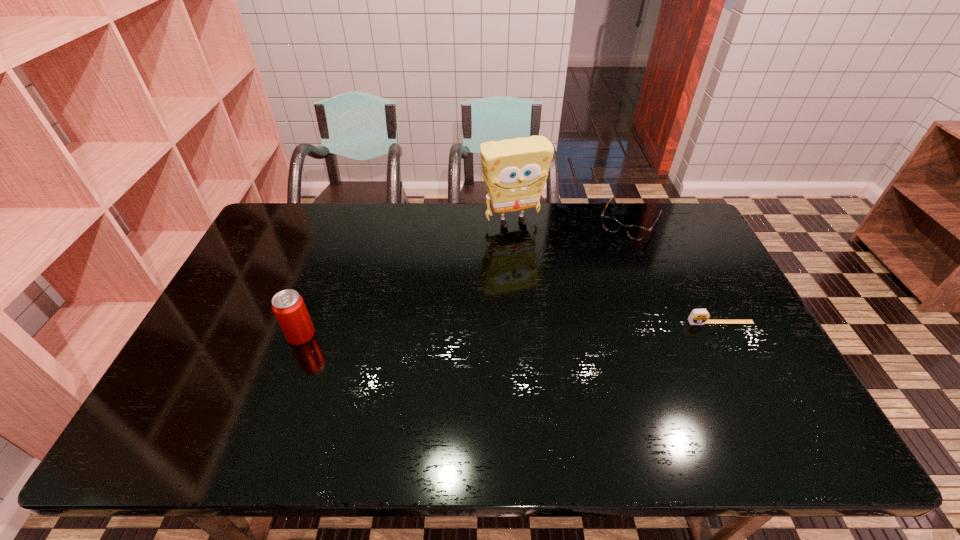
You are a GUI agent. You are given a task and a screenshot of the screen. Output one action in this format:
    pyautogui.click(x=<x>, y=<y>)
    Task: Click on the vacant space at the near edge of the desktop
    This screenshot has height=540, width=960.
    Given the screenshot: What is the action you would take?
    pyautogui.click(x=322, y=382)

Where is `free space at the left edge`? The height and width of the screenshot is (540, 960). free space at the left edge is located at coordinates (233, 329).

The height and width of the screenshot is (540, 960). In the image, there is a desktop. In order to click on vacant space at the right edge in this screenshot , I will do `click(778, 374)`.

Find the location of a particular element. The width and height of the screenshot is (960, 540). free space at the far left corner of the desktop is located at coordinates (283, 203).

The width and height of the screenshot is (960, 540). In the image, there is a desktop. What are the coordinates of `vacant space at the far right corner` in the screenshot? It's located at (661, 204).

You are a GUI agent. You are given a task and a screenshot of the screen. Output one action in this format:
    pyautogui.click(x=<x>, y=<y>)
    Task: Click on the vacant area between the spectacles and the leftmost object
    
    Given the screenshot: What is the action you would take?
    pyautogui.click(x=465, y=279)

I want to click on vacant area between the can and the tape measure, so click(x=511, y=329).

Identify the location of free space between the shortest object and the third shortest object. Image resolution: width=960 pixels, height=540 pixels. (511, 329).

At what (x,y) coordinates should I click in order to perform the action: click on empty space that is in between the tallest object and the spectacles. Please return your answer as a coordinate pair (x, y). The width and height of the screenshot is (960, 540). Looking at the image, I should click on (571, 222).

The width and height of the screenshot is (960, 540). I want to click on empty space between the leftmost object and the sponge, so click(407, 279).